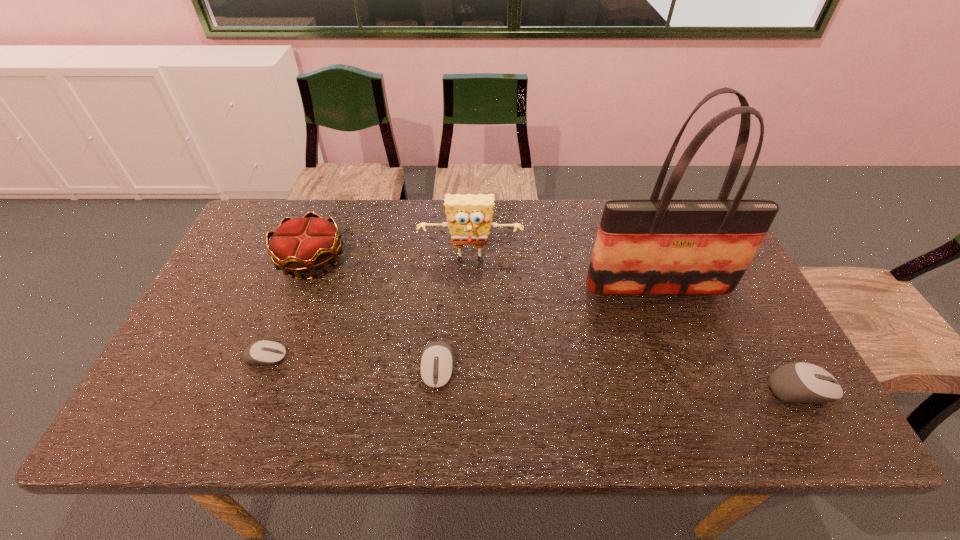
Where is `free space located on the back of the crown`? This screenshot has height=540, width=960. free space located on the back of the crown is located at coordinates (326, 222).

Identify the location of vacant area located 0.160m on the front-facing side of the shopping bag. (683, 352).

Identify the location of vacant space located on the face of the sponge. (468, 384).

The width and height of the screenshot is (960, 540). I want to click on object at the far edge, so click(x=301, y=245).

Locate an element on the screen. This screenshot has width=960, height=540. object that is at the left edge is located at coordinates (301, 245).

What are the coordinates of `computer equipment located in the right edge section of the desktop` in the screenshot? It's located at (800, 382).

Where is `shopping bag that is at the right edge`? shopping bag that is at the right edge is located at coordinates (666, 246).

Find the location of a particular element. This screenshot has height=540, width=960. object present at the far left corner is located at coordinates (301, 245).

Find the location of a particular element. This screenshot has width=960, height=540. object positioned at the near right corner is located at coordinates (800, 382).

Where is `free space at the far edge`? free space at the far edge is located at coordinates (505, 242).